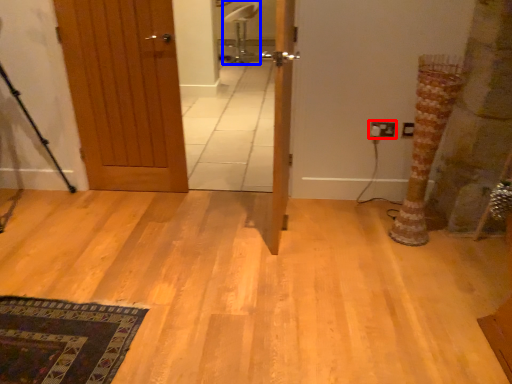
Question: Which point is further to the camera, electric outlet (highlighted by a red box) or chair (highlighted by a blue box)?

Choices:
 (A) electric outlet
 (B) chair

Answer: (B)